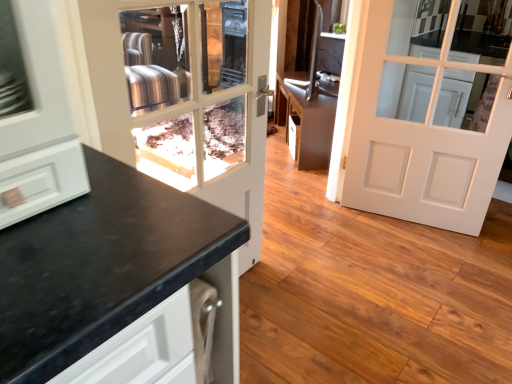
Question: Should I look upward or downward to see brown matte cabinet at center?

Choices:
 (A) up
 (B) down

Answer: (A)

Question: Does white matte door at center, placed as the first door when sorted from right to left, appear on the left side of brown matte cabinet at center?

Choices:
 (A) yes
 (B) no

Answer: (B)

Question: From the image's perspective, is white matte door at center, placed as the first door when sorted from right to left, beneath brown matte cabinet at center?

Choices:
 (A) yes
 (B) no

Answer: (A)

Question: Considering the relative sizes of white matte door at center, placed as the first door when sorted from right to left, and brown matte cabinet at center in the image provided, is white matte door at center, placed as the first door when sorted from right to left, thinner than brown matte cabinet at center?

Choices:
 (A) yes
 (B) no

Answer: (A)

Question: From the image's perspective, would you say white matte door at center, placed as the second door when sorted from left to right, is positioned over brown matte cabinet at center?

Choices:
 (A) no
 (B) yes

Answer: (A)

Question: From a real-world perspective, is white matte door at center, placed as the second door when sorted from left to right, on top of brown matte cabinet at center?

Choices:
 (A) no
 (B) yes

Answer: (B)

Question: Is white matte door at center, placed as the first door when sorted from right to left, smaller than brown matte cabinet at center?

Choices:
 (A) yes
 (B) no

Answer: (A)

Question: Is white matte door at center, placed as the first door when sorted from right to left, far away from matte black door at center, marked as the second door in a right-to-left arrangement?

Choices:
 (A) no
 (B) yes

Answer: (B)

Question: Is the position of white matte door at center, placed as the second door when sorted from left to right, less distant than that of matte black door at center, arranged as the first door when viewed from the left?

Choices:
 (A) no
 (B) yes

Answer: (A)

Question: From the image's perspective, is white matte door at center, placed as the second door when sorted from left to right, located above matte black door at center, marked as the second door in a right-to-left arrangement?

Choices:
 (A) no
 (B) yes

Answer: (B)

Question: Is white matte door at center, placed as the first door when sorted from right to left, not inside matte black door at center, marked as the second door in a right-to-left arrangement?

Choices:
 (A) yes
 (B) no

Answer: (A)

Question: Does white matte door at center, placed as the second door when sorted from left to right, have a lesser width compared to matte black door at center, arranged as the first door when viewed from the left?

Choices:
 (A) no
 (B) yes

Answer: (A)

Question: Is white matte door at center, placed as the first door when sorted from right to left, further to camera compared to matte black door at center, marked as the second door in a right-to-left arrangement?

Choices:
 (A) yes
 (B) no

Answer: (A)

Question: Can you confirm if brown matte cabinet at center is shorter than white matte door at center, placed as the second door when sorted from left to right?

Choices:
 (A) yes
 (B) no

Answer: (A)